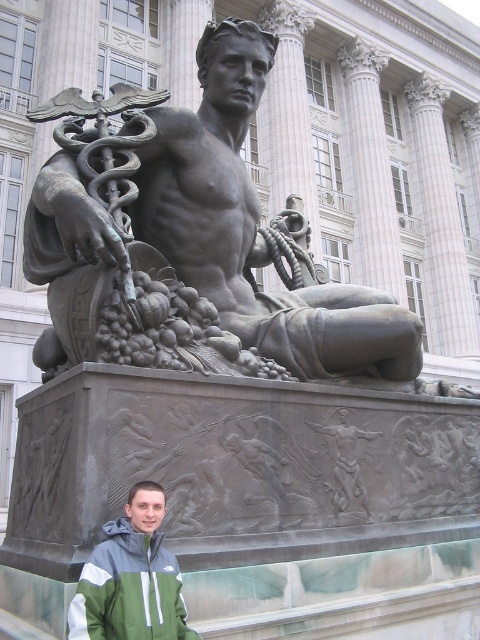
You are an art student who wants to draw the statue in the image. You notice the bronze statue at center and the green fabric jacket at lower left. Which object is placed higher in the image?

The bronze statue at center is positioned over the green fabric jacket at lower left, so the bronze statue at center is higher in the image.

You are a tour guide explaining the statue to visitors. A visitor asks if the green fabric jacket at lower left is in front of or behind the bronze statue at center. What do you tell them?

The green fabric jacket at lower left is behind the bronze statue at center.

You are an art student who needs to create a scale model of the bronze statue at center. You have a small mannequin that is the same size as the green fabric jacket at lower left. Can you use this mannequin to estimate the statue size?

The bronze statue at center is larger in size than the green fabric jacket at lower left. Since the mannequin is the same size as the green fabric jacket at lower left, you can use it to estimate that the bronze statue at center is bigger than the mannequin.